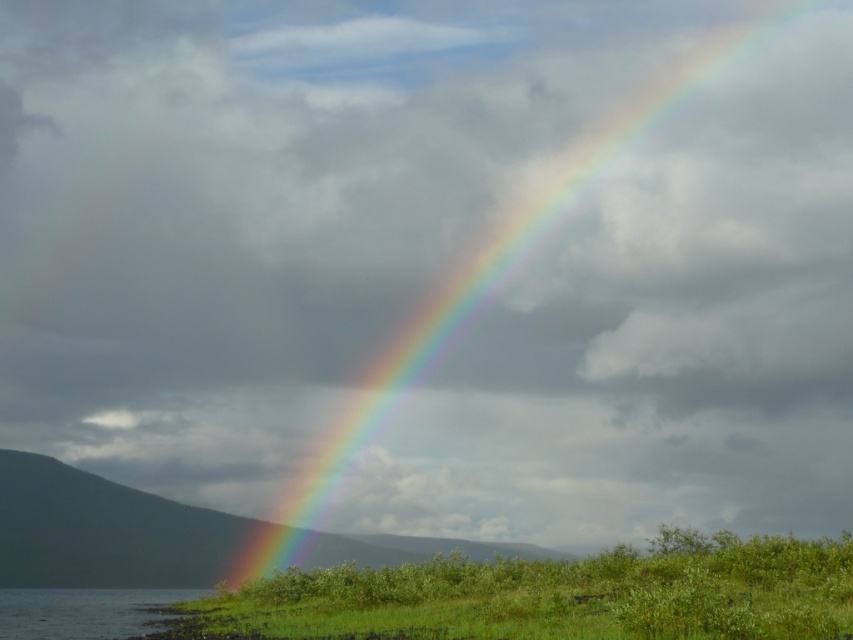
You are standing at the center of the image and want to walk towards the green leafy shrubs at lower center. Which direction should you move?

You should move towards the lower center direction to reach the green leafy shrubs at lower center, as they are located at point coordinates of 0.931 on the x axis and 0.649 on the y axis.

You are standing at the point marked by the coordinates point (553, 595) in the image. Looking towards the rainbow, which direction should you face to see the rainbow? The rainbow spans from the lower left to the upper right of the image.

Since the rainbow spans from the lower left to the upper right of the image and you are standing at point (553, 595) on green leafy shrubs at lower center, you should face towards the upper right direction to see the rainbow.

You are an artist trying to paint the landscape. You need to decide which object to paint first based on their sizes. According to the scene, which object should you paint first, the green leafy shrubs at lower center or the rainbow at upper center?

The green leafy shrubs at lower center has a smaller size compared to rainbow at upper center, so you should paint the rainbow at upper center first since it is larger and might require more space on the canvas.